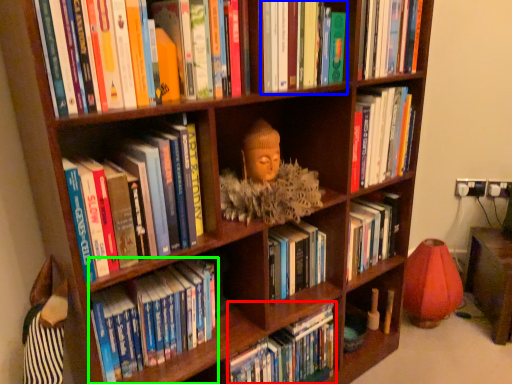
Question: Considering the real-world distances, which object is closest to book (highlighted by a red box)? book (highlighted by a blue box) or book (highlighted by a green box).

Choices:
 (A) book
 (B) book

Answer: (B)